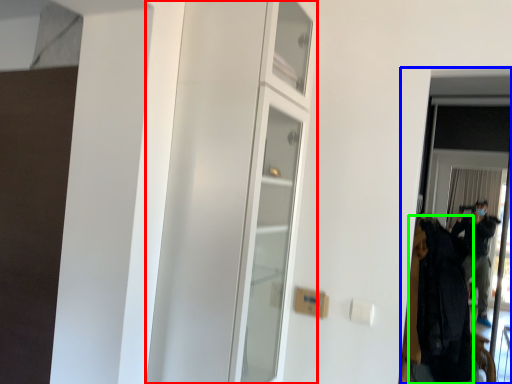
Question: Which object is the farthest from dresser (highlighted by a red box)? Choose among these: screen door (highlighted by a blue box) or clothing (highlighted by a green box).

Choices:
 (A) screen door
 (B) clothing

Answer: (A)